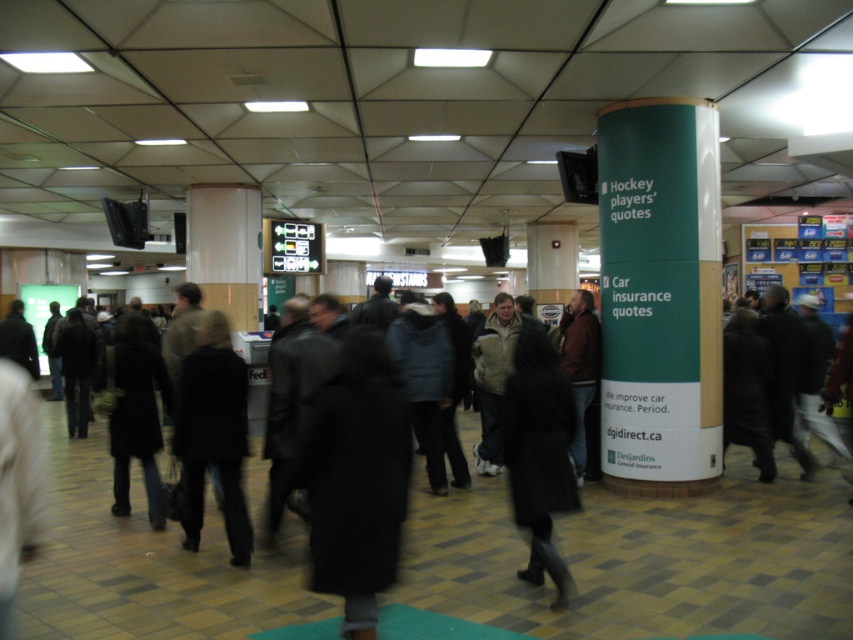
Question: Which of these objects is positioned farthest from the dark brown leather coat at center?

Choices:
 (A) dark wool coat at left
 (B) black leather coat at lower center
 (C) green matte sign at right
 (D) black wool coat at center

Answer: (C)

Question: Which object appears farthest from the camera in this image?

Choices:
 (A) black wool coat at center
 (B) dark brown leather coat at center
 (C) green matte sign at right
 (D) black leather coat at lower center

Answer: (C)

Question: From the image, what is the correct spatial relationship of green matte sign at right in relation to black wool coat at center?

Choices:
 (A) above
 (B) below

Answer: (A)

Question: Can you confirm if black leather coat at lower center is wider than dark brown leather coat at center?

Choices:
 (A) yes
 (B) no

Answer: (B)

Question: Can you confirm if dark brown leather coat at center is positioned to the right of dark wool coat at left?

Choices:
 (A) yes
 (B) no

Answer: (A)

Question: Which point is farther to the camera?

Choices:
 (A) dark wool coat at left
 (B) black leather coat at lower center
 (C) black wool coat at center
 (D) dark brown leather coat at center

Answer: (A)